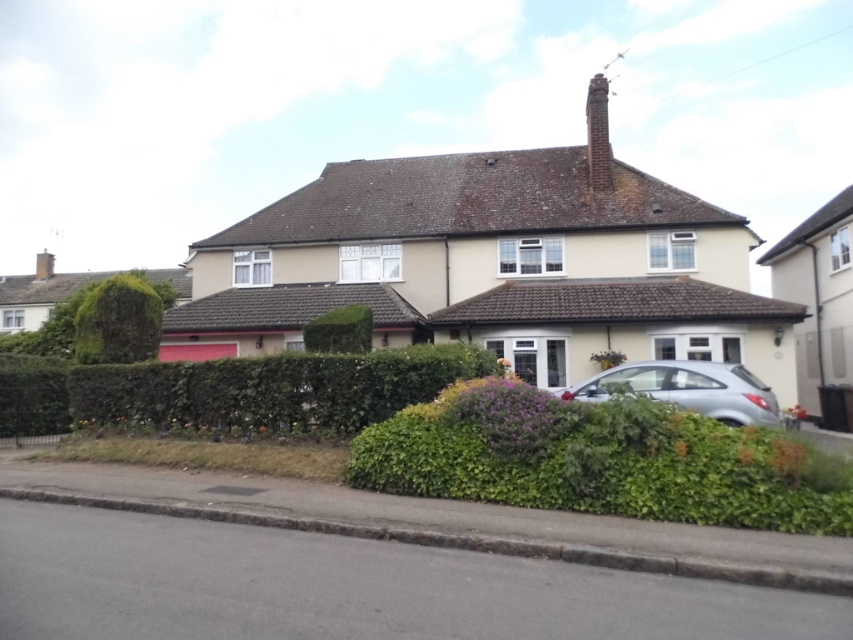
You are a gardener planning to trim the green leafy bush at left and the brick chimney at upper center. Based on their widths, which object requires more effort to trim? Please explain your reasoning.

The brick chimney at upper center requires more effort to trim because its width is greater than the green leafy bush at left, as stated in the description.

You are standing at the point marked by the coordinates point (x=119, y=321) in the image. What object is exactly at that location?

The green leafy bush at left is exactly at point (x=119, y=321).

You are standing in front of the house and want to know which object is taller between the green leafy bush at left and the brick chimney at upper center. Based on the scene, can you determine which one is taller?

The brick chimney at upper center is taller than the green leafy bush at left.